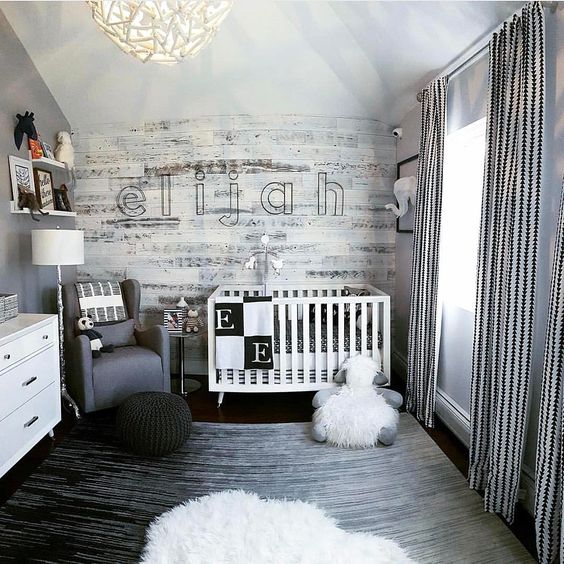
The image size is (564, 564). Identify the location of baby toy. (262, 252).